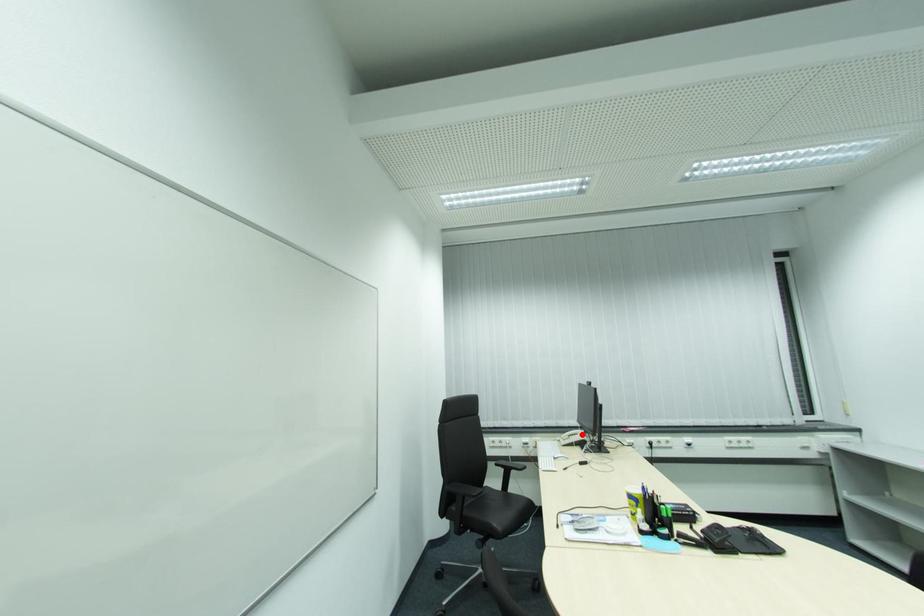
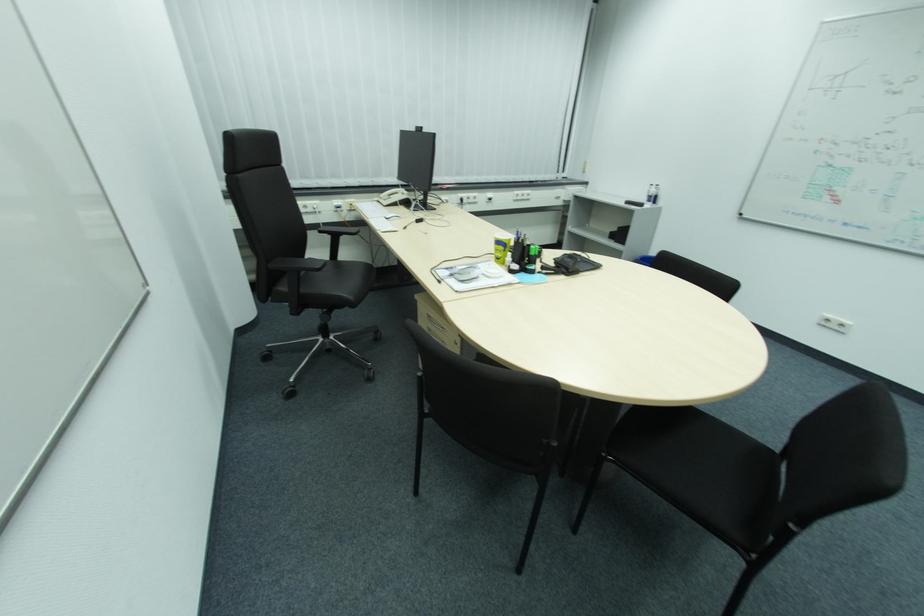
Question: I am providing you with two images of the same scene from different viewpoints. A red point is shown in image1. For the corresponding object point in image2, is it positioned nearer or farther from the camera?

Choices:
 (A) Nearer
 (B) Farther

Answer: (A)